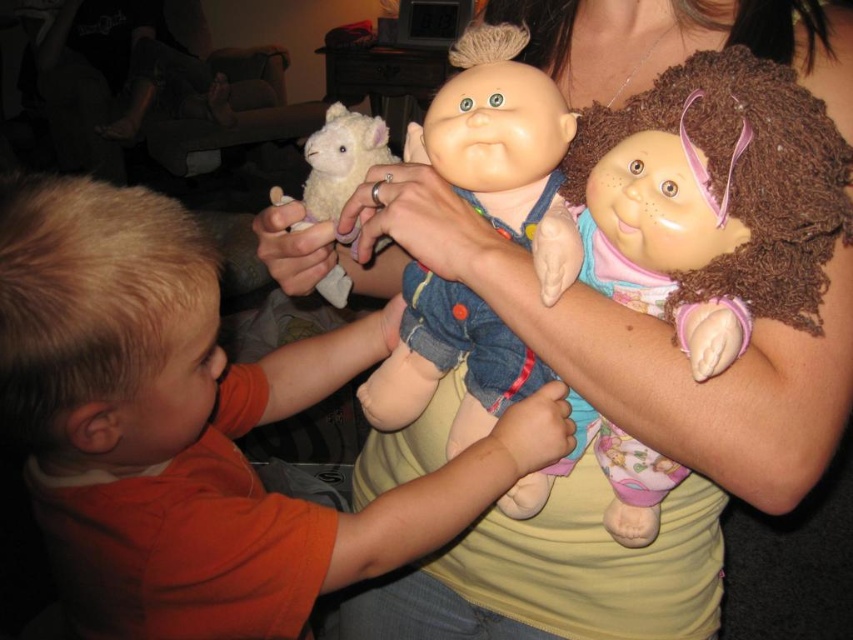
Who is positioned more to the right, orange cotton shirt at left or smooth plastic dolls at center?

smooth plastic dolls at center

Can you confirm if orange cotton shirt at left is bigger than smooth plastic dolls at center?

Yes, orange cotton shirt at left is bigger than smooth plastic dolls at center.

Locate an element on the screen. orange cotton shirt at left is located at coordinates (194, 428).

Locate an element on the screen. orange cotton shirt at left is located at coordinates (194, 428).

Between smooth plastic dolls at center and fluffy white lamb at center, which one has more height?

smooth plastic dolls at center

Does smooth plastic dolls at center have a smaller size compared to fluffy white lamb at center?

No, smooth plastic dolls at center is not smaller than fluffy white lamb at center.

Is point (622, 282) closer to viewer compared to point (321, 177)?

Yes, point (622, 282) is in front of point (321, 177).

You are a GUI agent. You are given a task and a screenshot of the screen. Output one action in this format:
    pyautogui.click(x=<x>, y=<y>)
    Task: Click on the smooth plastic dolls at center
    This screenshot has width=853, height=640.
    Given the screenshot: What is the action you would take?
    pyautogui.click(x=711, y=202)

Which is above, smooth plastic doll at center or fluffy white lamb at center?

fluffy white lamb at center is above.

The height and width of the screenshot is (640, 853). Describe the element at coordinates (503, 147) in the screenshot. I see `smooth plastic doll at center` at that location.

Locate an element on the screen. smooth plastic doll at center is located at coordinates (503, 147).